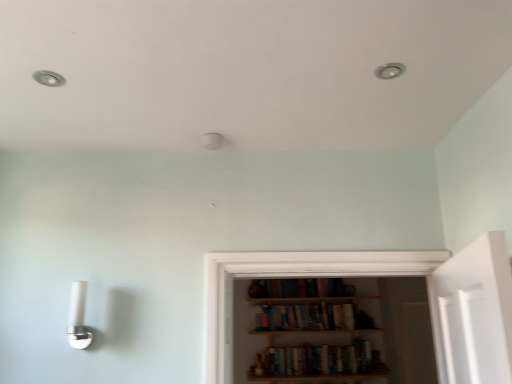
Question: Considering the relative sizes of matte white light fixture at upper left and hardcover books at center, the 2th book when ordered from bottom to top, in the image provided, is matte white light fixture at upper left wider than hardcover books at center, the 2th book when ordered from bottom to top,?

Choices:
 (A) yes
 (B) no

Answer: (B)

Question: Is matte white light fixture at upper left shorter than hardcover books at center, the 2th book when ordered from bottom to top?

Choices:
 (A) yes
 (B) no

Answer: (A)

Question: Are matte white light fixture at upper left and hardcover books at center, the 2th book when ordered from bottom to top, making contact?

Choices:
 (A) yes
 (B) no

Answer: (B)

Question: Is matte white light fixture at upper left further to the viewer compared to hardcover books at center, placed as the first book when sorted from top to bottom?

Choices:
 (A) yes
 (B) no

Answer: (B)

Question: Considering the relative sizes of matte white light fixture at upper left and hardcover books at center, the 2th book when ordered from bottom to top, in the image provided, is matte white light fixture at upper left thinner than hardcover books at center, the 2th book when ordered from bottom to top,?

Choices:
 (A) yes
 (B) no

Answer: (A)

Question: Is matte white light fixture at upper left looking in the opposite direction of hardcover books at center, the 2th book when ordered from bottom to top?

Choices:
 (A) yes
 (B) no

Answer: (B)

Question: Does hardcover books at center, marked as the 2th book in a top-to-bottom arrangement, have a lesser height compared to matte white light fixture at upper left?

Choices:
 (A) no
 (B) yes

Answer: (A)

Question: Is hardcover books at center, the 1th book ordered from the bottom, closer to the viewer compared to matte white light fixture at upper left?

Choices:
 (A) no
 (B) yes

Answer: (A)

Question: From the image's perspective, is hardcover books at center, marked as the 2th book in a top-to-bottom arrangement, on top of matte white light fixture at upper left?

Choices:
 (A) yes
 (B) no

Answer: (B)

Question: Is hardcover books at center, the 1th book ordered from the bottom, taller than matte white light fixture at upper left?

Choices:
 (A) yes
 (B) no

Answer: (A)

Question: Is hardcover books at center, marked as the 2th book in a top-to-bottom arrangement, to the left of matte white light fixture at upper left from the viewer's perspective?

Choices:
 (A) yes
 (B) no

Answer: (B)

Question: Could you tell me if hardcover books at center, the 1th book ordered from the bottom, is facing matte white light fixture at upper left?

Choices:
 (A) no
 (B) yes

Answer: (A)

Question: Is hardcover books at center, the 2th book when ordered from bottom to top, at the left side of hardcover books at center, marked as the 2th book in a top-to-bottom arrangement?

Choices:
 (A) yes
 (B) no

Answer: (A)